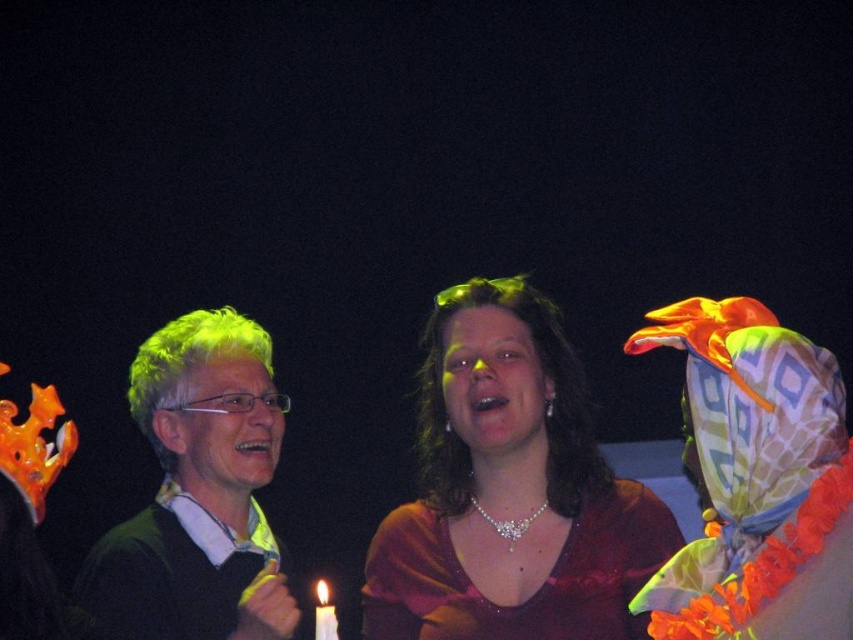
Is satin burgundy dress at center further to camera compared to smooth skin face at center?

No, satin burgundy dress at center is closer to the viewer.

Does satin burgundy dress at center have a greater height compared to smooth skin face at center?

Yes, satin burgundy dress at center is taller than smooth skin face at center.

Is point (460, 493) positioned in front of point (550, 401)?

Yes, point (460, 493) is in front of point (550, 401).

Identify the location of satin burgundy dress at center. The width and height of the screenshot is (853, 640). (509, 490).

Does satin burgundy dress at center appear on the left side of matte black face at center?

In fact, satin burgundy dress at center is to the right of matte black face at center.

Does satin burgundy dress at center appear under matte black face at center?

Yes, satin burgundy dress at center is below matte black face at center.

Image resolution: width=853 pixels, height=640 pixels. Find the location of `satin burgundy dress at center`. satin burgundy dress at center is located at coordinates (509, 490).

Identify the location of satin burgundy dress at center. The image size is (853, 640). (509, 490).

Is smooth skin face at center wider than matte black face at center?

In fact, smooth skin face at center might be narrower than matte black face at center.

Which is behind, point (498, 381) or point (207, 387)?

The point (207, 387) is more distant.

Measure the distance between point (x=457, y=321) and camera.

Point (x=457, y=321) and camera are 2.24 meters apart from each other.

The height and width of the screenshot is (640, 853). What are the coordinates of `smooth skin face at center` in the screenshot? It's located at (492, 380).